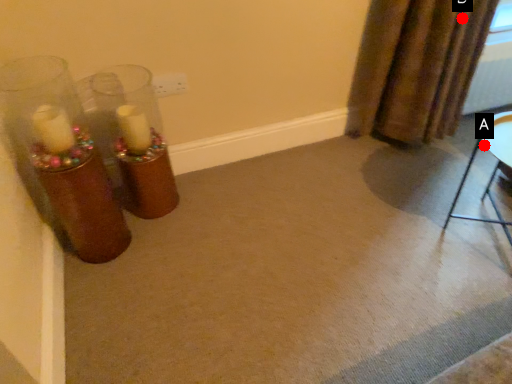
Question: Two points are circled on the image, labeled by A and B beside each circle. Which point is closer to the camera taking this photo?

Choices:
 (A) A is closer
 (B) B is closer

Answer: (B)